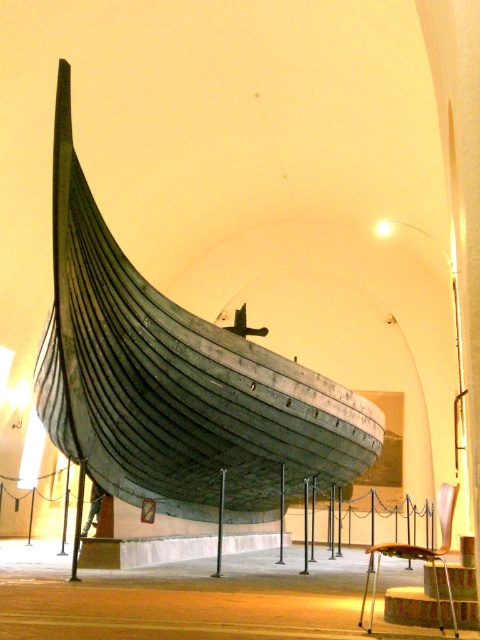
Question: Does wooden boat at center appear over wooden textured stool at lower right?

Choices:
 (A) yes
 (B) no

Answer: (A)

Question: Does wooden boat at center lie in front of wooden textured stool at lower right?

Choices:
 (A) yes
 (B) no

Answer: (B)

Question: Does wooden boat at center have a smaller size compared to wooden textured stool at lower right?

Choices:
 (A) no
 (B) yes

Answer: (B)